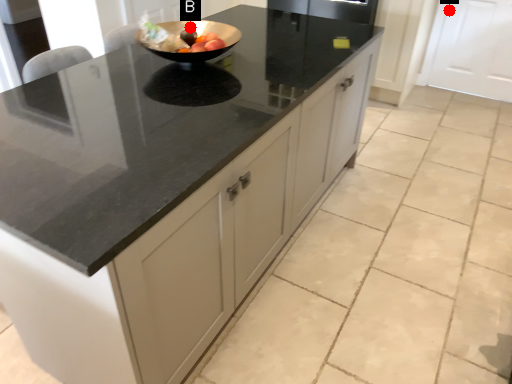
Question: Two points are circled on the image, labeled by A and B beside each circle. Which point is closer to the camera?

Choices:
 (A) A is closer
 (B) B is closer

Answer: (B)